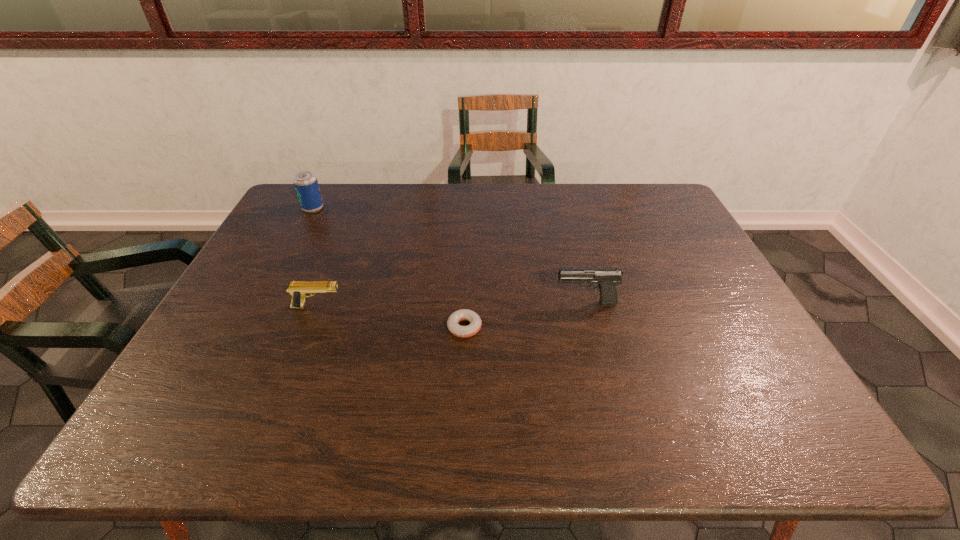
Locate an element on the screen. The height and width of the screenshot is (540, 960). vacant space at the far left corner is located at coordinates (298, 197).

You are a GUI agent. You are given a task and a screenshot of the screen. Output one action in this format:
    pyautogui.click(x=<x>, y=<y>)
    Task: Click on the free spot between the leftmost object and the doughnut
    The image size is (960, 540).
    Given the screenshot: What is the action you would take?
    pyautogui.click(x=389, y=268)

I want to click on vacant space that is in between the shorter pistol and the nearest object, so click(391, 317).

Where is `vacant region between the shorter pistol and the doughnut`? vacant region between the shorter pistol and the doughnut is located at coordinates (391, 317).

The width and height of the screenshot is (960, 540). I want to click on vacant area that lies between the doughnut and the farthest object, so click(x=389, y=268).

Identify the location of unoccupied area between the second shortest object and the rightmost object. (451, 305).

Where is `vacant space that's between the left pistol and the right pistol`? vacant space that's between the left pistol and the right pistol is located at coordinates (451, 305).

This screenshot has width=960, height=540. Find the location of `vacant space in between the farthest object and the second shortest object`. vacant space in between the farthest object and the second shortest object is located at coordinates pyautogui.click(x=315, y=258).

Where is `vacant space that is in between the left pistol and the shortest object`? vacant space that is in between the left pistol and the shortest object is located at coordinates (391, 317).

The height and width of the screenshot is (540, 960). I want to click on free area in between the right pistol and the beer can, so click(449, 256).